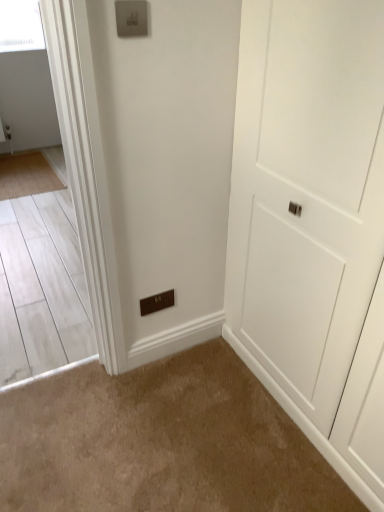
Question: Is the position of white matte door at center more distant than that of bamboo mat at left?

Choices:
 (A) yes
 (B) no

Answer: (B)

Question: From the image's perspective, is white matte door at center beneath bamboo mat at left?

Choices:
 (A) no
 (B) yes

Answer: (B)

Question: Is bamboo mat at left surrounded by white matte door at center?

Choices:
 (A) no
 (B) yes

Answer: (A)

Question: Can you confirm if white matte door at center is smaller than bamboo mat at left?

Choices:
 (A) no
 (B) yes

Answer: (A)

Question: Is white matte door at center oriented towards bamboo mat at left?

Choices:
 (A) yes
 (B) no

Answer: (B)

Question: In terms of width, does brown matte switchplate at lower center look wider or thinner when compared to bamboo mat at left?

Choices:
 (A) thin
 (B) wide

Answer: (B)

Question: Based on their sizes in the image, would you say brown matte switchplate at lower center is bigger or smaller than bamboo mat at left?

Choices:
 (A) big
 (B) small

Answer: (A)

Question: Considering the positions of point (150, 483) and point (6, 192), is point (150, 483) closer or farther from the camera than point (6, 192)?

Choices:
 (A) closer
 (B) farther

Answer: (A)

Question: From a real-world perspective, is brown matte switchplate at lower center above or below bamboo mat at left?

Choices:
 (A) below
 (B) above

Answer: (B)

Question: From a real-world perspective, is brown plastic light switch at lower center, the 2th light switch positioned from the front, positioned above or below bamboo mat at left?

Choices:
 (A) below
 (B) above

Answer: (B)

Question: Is brown plastic light switch at lower center, the 1th light switch positioned from the back, taller or shorter than bamboo mat at left?

Choices:
 (A) short
 (B) tall

Answer: (B)

Question: Considering the positions of brown plastic light switch at lower center, the 1th light switch positioned from the back, and bamboo mat at left in the image, is brown plastic light switch at lower center, the 1th light switch positioned from the back, wider or thinner than bamboo mat at left?

Choices:
 (A) thin
 (B) wide

Answer: (A)

Question: Which is correct: brown plastic light switch at lower center, which is the first light switch in bottom-to-top order, is inside bamboo mat at left, or outside of it?

Choices:
 (A) outside
 (B) inside

Answer: (A)

Question: Looking at the image, does satin silver switch at upper center, which is the second light switch in bottom-to-top order, seem bigger or smaller compared to bamboo mat at left?

Choices:
 (A) small
 (B) big

Answer: (A)

Question: From a real-world perspective, relative to bamboo mat at left, is satin silver switch at upper center, which is the second light switch in bottom-to-top order, vertically above or below?

Choices:
 (A) below
 (B) above

Answer: (B)